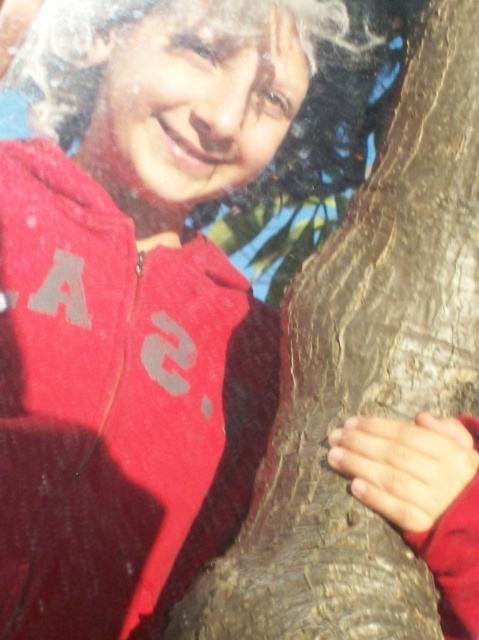
Can you confirm if matte red jacket at left is positioned to the right of curly blonde hair at upper left?

No, matte red jacket at left is not to the right of curly blonde hair at upper left.

Which is in front, point (154, 314) or point (320, 86)?

Point (154, 314)

Is point (215, 332) closer to viewer compared to point (337, 20)?

No, it is not.

Where is `matte red jacket at left`? The height and width of the screenshot is (640, 479). matte red jacket at left is located at coordinates (116, 406).